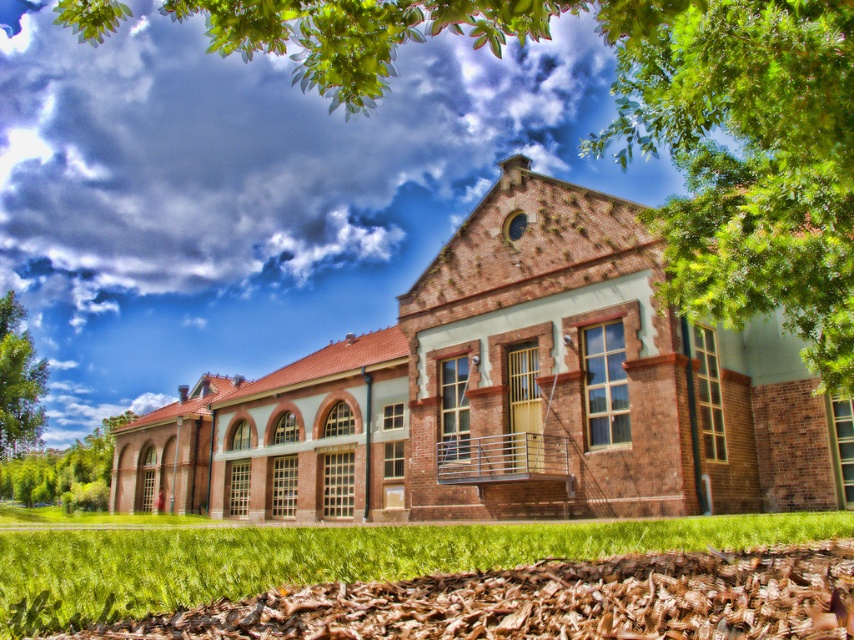
Does point (39, 451) come in front of point (7, 417)?

No, (39, 451) is behind (7, 417).

Measure the distance between green leafy tree at lower left and camera.

green leafy tree at lower left and camera are 195.42 feet apart.

Locate an element on the screen. The height and width of the screenshot is (640, 854). green leafy tree at lower left is located at coordinates (65, 470).

This screenshot has width=854, height=640. I want to click on green leafy tree at lower left, so click(x=65, y=470).

What do you see at coordinates (654, 129) in the screenshot?
I see `green leafy tree at upper center` at bounding box center [654, 129].

Where is `green leafy tree at upper center`? green leafy tree at upper center is located at coordinates pos(654,129).

Where is `green leafy tree at upper center`? This screenshot has width=854, height=640. green leafy tree at upper center is located at coordinates (654, 129).

The image size is (854, 640). In order to click on green leafy tree at upper center in this screenshot , I will do `click(654, 129)`.

Which of these two, green leafy tree at upper center or green leafy tree at left, stands shorter?

With less height is green leafy tree at left.

Is green leafy tree at upper center below green leafy tree at left?

Incorrect, green leafy tree at upper center is not positioned below green leafy tree at left.

Is point (847, 33) positioned after point (3, 426)?

No, (847, 33) is in front of (3, 426).

At what (x,y) coordinates should I click in order to perform the action: click on green leafy tree at upper center. Please return your answer as a coordinate pair (x, y). This screenshot has width=854, height=640. Looking at the image, I should click on (654, 129).